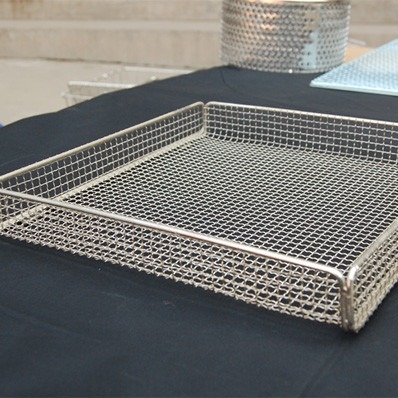
Find the location of a particular element. The width and height of the screenshot is (398, 398). dark blue tablecloth is located at coordinates (126, 339).